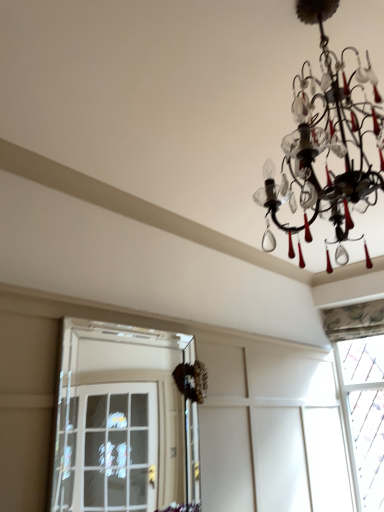
Question: From the image's perspective, would you say black glass chandelier at upper right is shown under patterned fabric curtain at upper right, the first window viewed from the back?

Choices:
 (A) no
 (B) yes

Answer: (A)

Question: Does black glass chandelier at upper right touch patterned fabric curtain at upper right, positioned as the second window in front-to-back order?

Choices:
 (A) yes
 (B) no

Answer: (B)

Question: Can you confirm if black glass chandelier at upper right is bigger than patterned fabric curtain at upper right, the first window in the right-to-left sequence?

Choices:
 (A) yes
 (B) no

Answer: (A)

Question: Is black glass chandelier at upper right taller than patterned fabric curtain at upper right, the first window viewed from the back?

Choices:
 (A) no
 (B) yes

Answer: (A)

Question: From a real-world perspective, is black glass chandelier at upper right on patterned fabric curtain at upper right, which is the 2th window in left-to-right order?

Choices:
 (A) yes
 (B) no

Answer: (A)

Question: From the image's perspective, is black glass chandelier at upper right positioned above or below patterned fabric curtain at upper right, positioned as the second window in front-to-back order?

Choices:
 (A) below
 (B) above

Answer: (B)

Question: Relative to patterned fabric curtain at upper right, the first window in the right-to-left sequence, is black glass chandelier at upper right in front or behind?

Choices:
 (A) front
 (B) behind

Answer: (A)

Question: Is black glass chandelier at upper right situated inside patterned fabric curtain at upper right, which is the 2th window in left-to-right order, or outside?

Choices:
 (A) outside
 (B) inside

Answer: (A)

Question: In the image, is black glass chandelier at upper right on the left side or the right side of patterned fabric curtain at upper right, positioned as the second window in front-to-back order?

Choices:
 (A) left
 (B) right

Answer: (A)

Question: Is point (374, 354) closer or farther from the camera than point (122, 330)?

Choices:
 (A) closer
 (B) farther

Answer: (B)

Question: Considering the positions of patterned fabric curtain at upper right, the first window viewed from the back, and clear glass door at left, marked as the 1th window in a left-to-right arrangement, in the image, is patterned fabric curtain at upper right, the first window viewed from the back, bigger or smaller than clear glass door at left, marked as the 1th window in a left-to-right arrangement,?

Choices:
 (A) small
 (B) big

Answer: (B)

Question: In the image, is patterned fabric curtain at upper right, the first window viewed from the back, on the left side or the right side of clear glass door at left, which is the second window from right to left?

Choices:
 (A) right
 (B) left

Answer: (A)

Question: From the image's perspective, is patterned fabric curtain at upper right, positioned as the second window in front-to-back order, positioned above or below clear glass door at left, which ranks as the second window in back-to-front order?

Choices:
 (A) above
 (B) below

Answer: (B)

Question: In terms of height, does patterned fabric curtain at upper right, the first window in the right-to-left sequence, look taller or shorter compared to black glass chandelier at upper right?

Choices:
 (A) tall
 (B) short

Answer: (A)

Question: Does point (357, 433) appear closer or farther from the camera than point (266, 175)?

Choices:
 (A) closer
 (B) farther

Answer: (B)